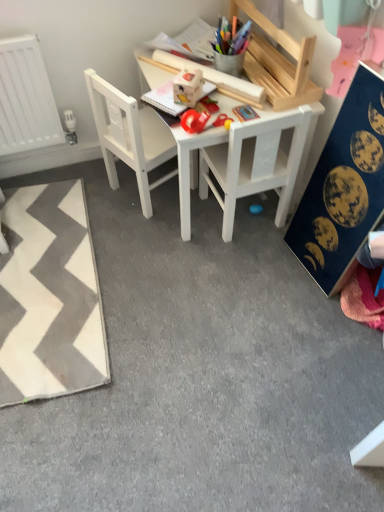
Where is `free point above white matte chair at center, placed as the second chair when sorted from left to right (from a real-world perspective)`? free point above white matte chair at center, placed as the second chair when sorted from left to right (from a real-world perspective) is located at coordinates (253, 91).